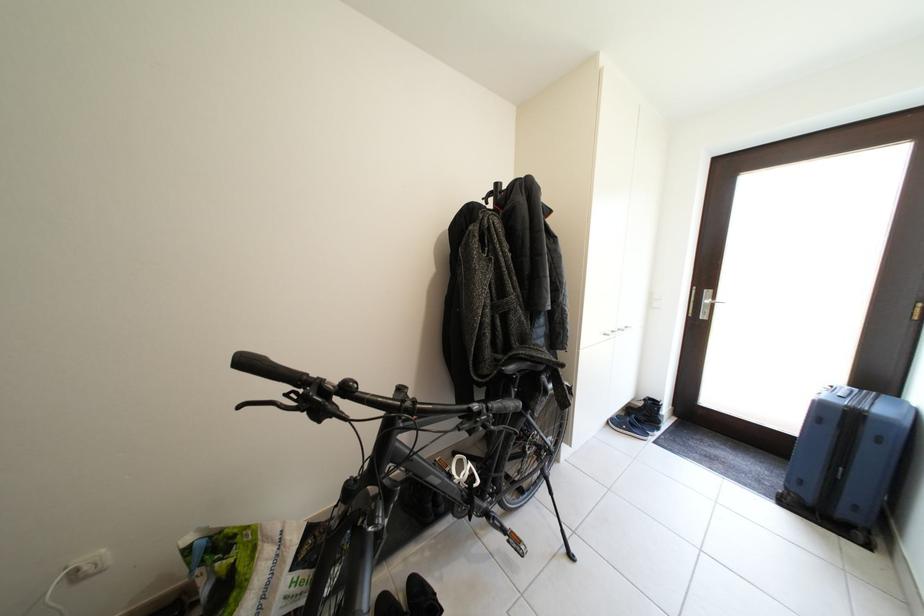
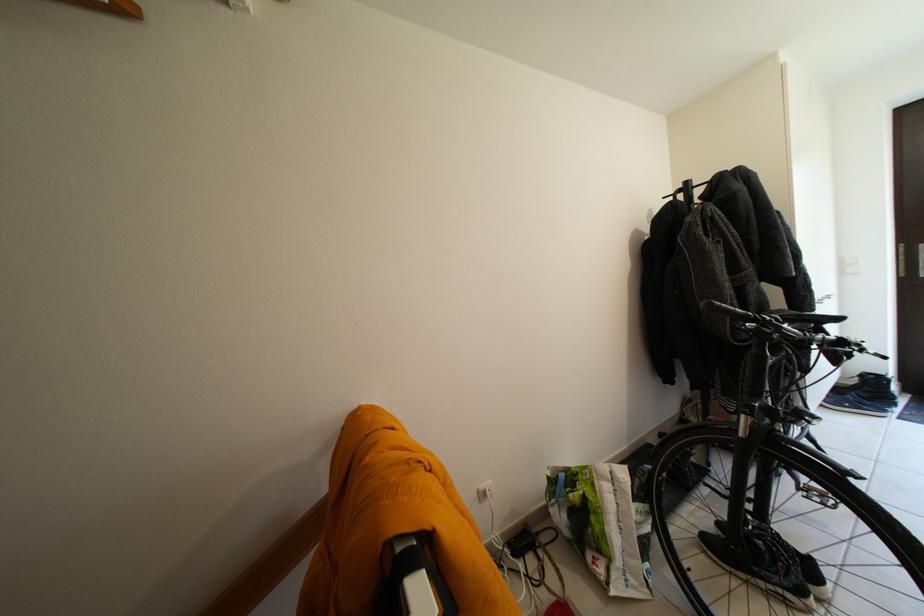
The point at (525, 557) is marked in the first image. Where is the corresponding point in the second image?

(832, 509)